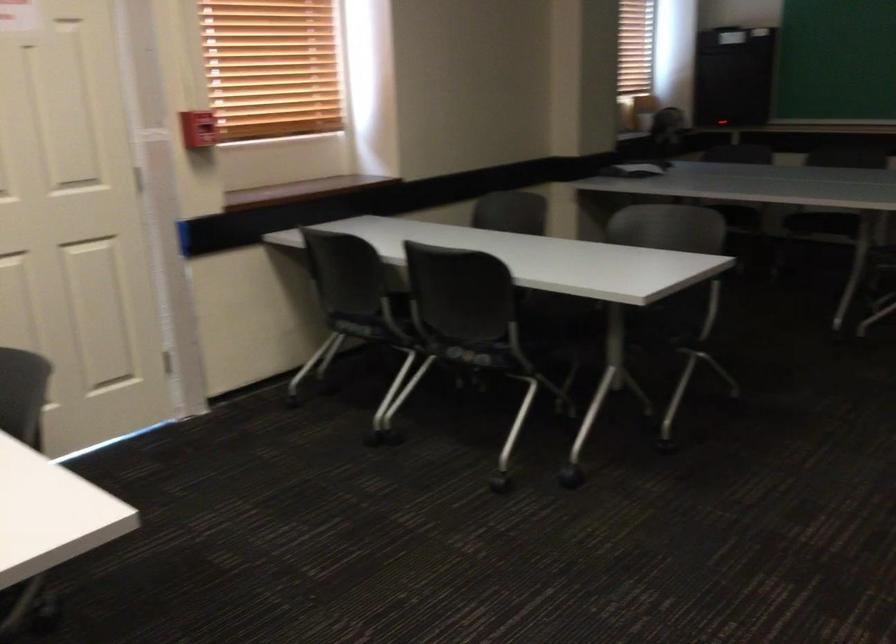
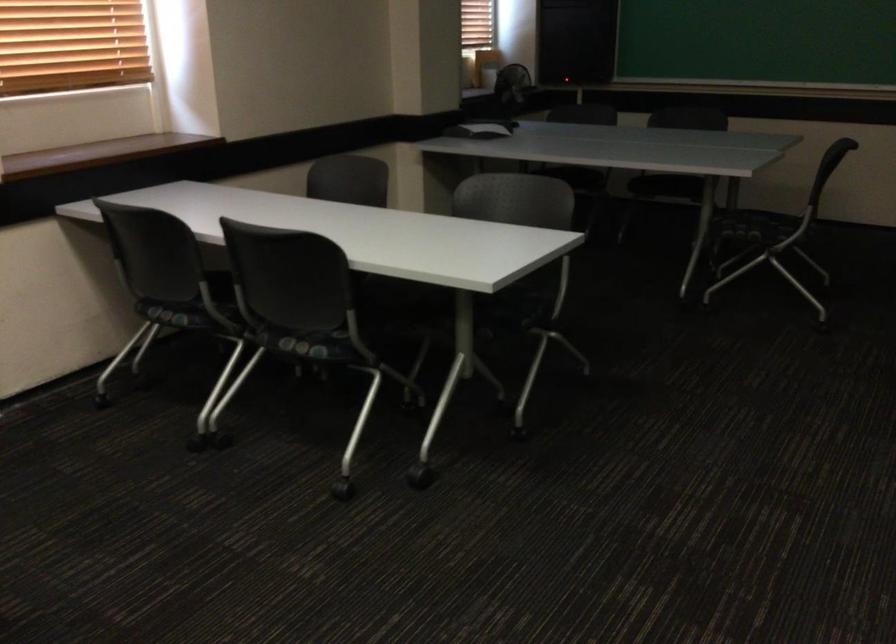
Question: Which direction would the cameraman need to move to produce the second image? Reply with the corresponding letter.

Choices:
 (A) Left
 (B) Right
 (C) Forward
 (D) Backward

Answer: (C)